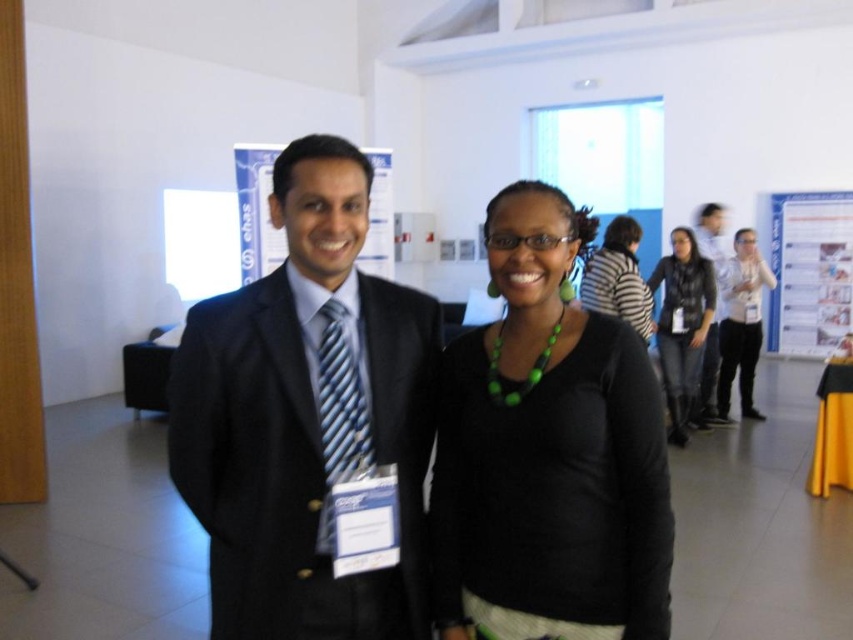
Question: Is matte black shirt at center bigger than white shirt at right?

Choices:
 (A) yes
 (B) no

Answer: (B)

Question: Estimate the real-world distances between objects in this image. Which object is farther from the black matte jacket at center?

Choices:
 (A) matte black shirt at right
 (B) matte black shirt at center
 (C) matte black suit at center
 (D) black leather jacket at center

Answer: (C)

Question: Which point is closer to the camera?

Choices:
 (A) matte black shirt at right
 (B) black matte jacket at center
 (C) black leather jacket at center
 (D) matte black shirt at center

Answer: (D)

Question: Is black leather jacket at center further to camera compared to matte black shirt at right?

Choices:
 (A) yes
 (B) no

Answer: (B)

Question: Does matte black shirt at center have a greater width compared to matte black shirt at right?

Choices:
 (A) yes
 (B) no

Answer: (B)

Question: Estimate the real-world distances between objects in this image. Which object is farther from the white paperboard at upper right?

Choices:
 (A) white shirt at right
 (B) black matte jacket at center
 (C) matte black shirt at center
 (D) black leather jacket at center

Answer: (C)